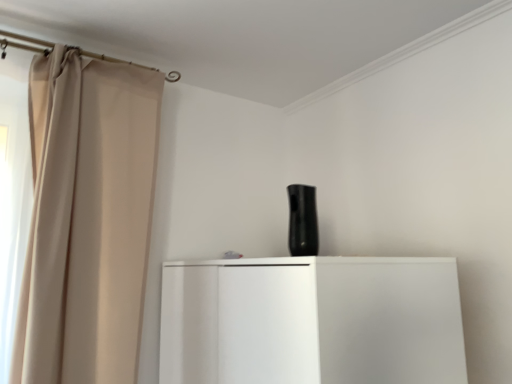
Question: Considering the relative sizes of beige fabric curtain at left and black matte speaker at center in the image provided, is beige fabric curtain at left taller than black matte speaker at center?

Choices:
 (A) no
 (B) yes

Answer: (B)

Question: Is beige fabric curtain at left closer to the viewer compared to black matte speaker at center?

Choices:
 (A) no
 (B) yes

Answer: (B)

Question: Is beige fabric curtain at left bigger than black matte speaker at center?

Choices:
 (A) yes
 (B) no

Answer: (A)

Question: Is beige fabric curtain at left not near black matte speaker at center?

Choices:
 (A) no
 (B) yes

Answer: (A)

Question: Is beige fabric curtain at left with black matte speaker at center?

Choices:
 (A) no
 (B) yes

Answer: (A)

Question: Could you tell me if beige fabric curtain at left is facing black matte speaker at center?

Choices:
 (A) no
 (B) yes

Answer: (A)

Question: Is black matte speaker at center facing away from beige fabric curtain at left?

Choices:
 (A) no
 (B) yes

Answer: (A)

Question: Considering the relative positions of black matte speaker at center and beige fabric curtain at left in the image provided, is black matte speaker at center to the right of beige fabric curtain at left from the viewer's perspective?

Choices:
 (A) yes
 (B) no

Answer: (A)

Question: Considering the relative sizes of black matte speaker at center and beige fabric curtain at left in the image provided, is black matte speaker at center smaller than beige fabric curtain at left?

Choices:
 (A) yes
 (B) no

Answer: (A)

Question: Is black matte speaker at center at the left side of beige fabric curtain at left?

Choices:
 (A) no
 (B) yes

Answer: (A)

Question: Is black matte speaker at center not inside beige fabric curtain at left?

Choices:
 (A) yes
 (B) no

Answer: (A)

Question: Does black matte speaker at center have a lesser width compared to beige fabric curtain at left?

Choices:
 (A) yes
 (B) no

Answer: (A)

Question: In terms of width, does beige fabric curtain at left look wider or thinner when compared to black matte speaker at center?

Choices:
 (A) thin
 (B) wide

Answer: (B)